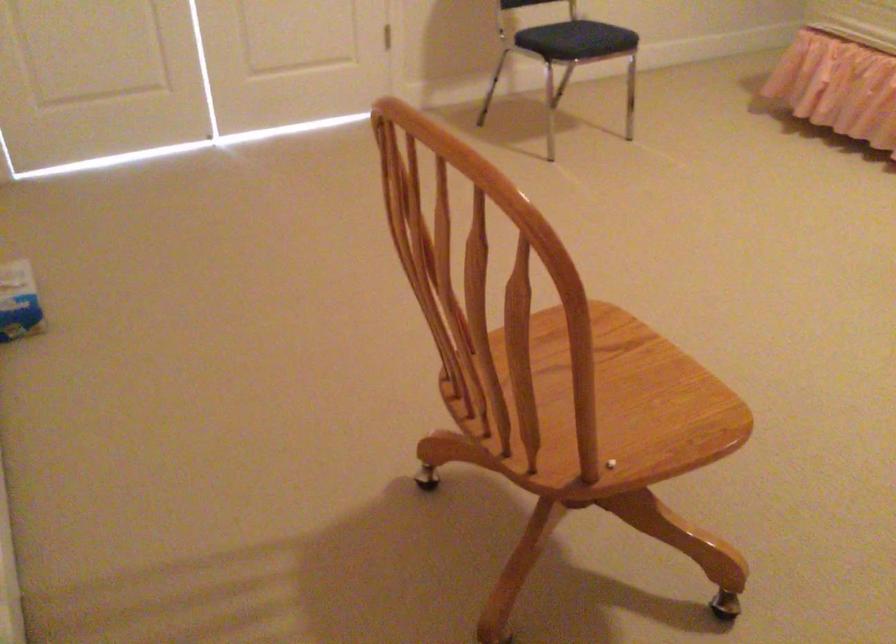
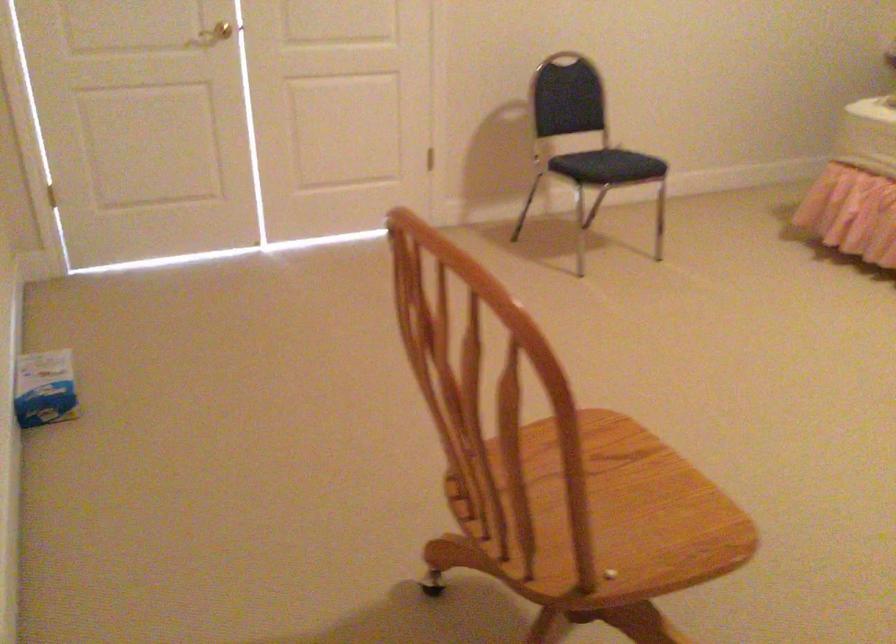
Find the pixel in the second image that matches pixel 614 404 in the first image.

(613, 509)